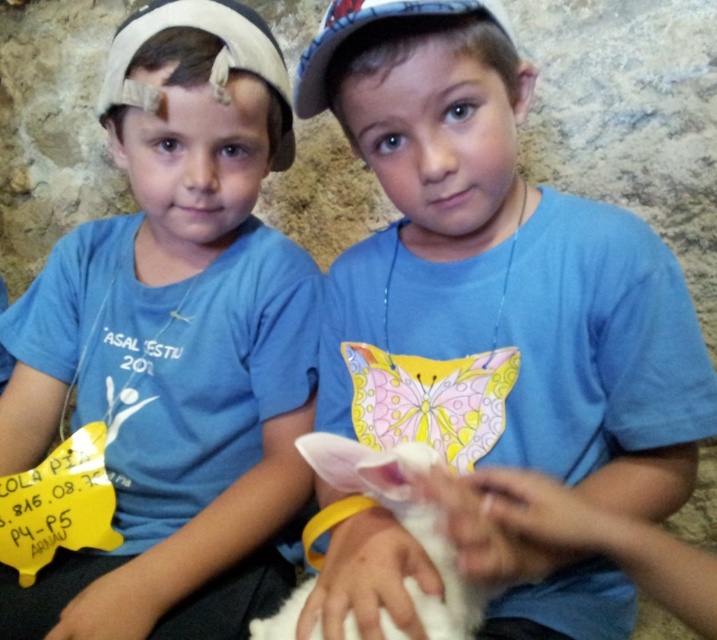
Between blue cotton shirt at center and white fabric baseball cap at upper center, which one appears on the left side from the viewer's perspective?

white fabric baseball cap at upper center is more to the left.

Which is above, blue cotton shirt at center or white fabric baseball cap at upper center?

white fabric baseball cap at upper center is above.

This screenshot has height=640, width=717. What do you see at coordinates (493, 275) in the screenshot?
I see `blue cotton shirt at center` at bounding box center [493, 275].

Where is `blue cotton shirt at center`? This screenshot has height=640, width=717. blue cotton shirt at center is located at coordinates (493, 275).

Does blue cotton shirt at center have a lesser height compared to blue matte shirt at center?

Correct, blue cotton shirt at center is not as tall as blue matte shirt at center.

Who is more forward, (x=343, y=586) or (x=244, y=45)?

Point (x=343, y=586) is in front.

Identify the location of blue cotton shirt at center. Image resolution: width=717 pixels, height=640 pixels. (493, 275).

The height and width of the screenshot is (640, 717). In order to click on blue cotton shirt at center in this screenshot , I will do `click(493, 275)`.

Between blue matte shirt at center and white fluffy rabbit at center, which one appears on the left side from the viewer's perspective?

blue matte shirt at center is more to the left.

Is blue matte shirt at center to the right of white fluffy rabbit at center from the viewer's perspective?

Incorrect, blue matte shirt at center is not on the right side of white fluffy rabbit at center.

Locate an element on the screen. The width and height of the screenshot is (717, 640). blue matte shirt at center is located at coordinates (163, 356).